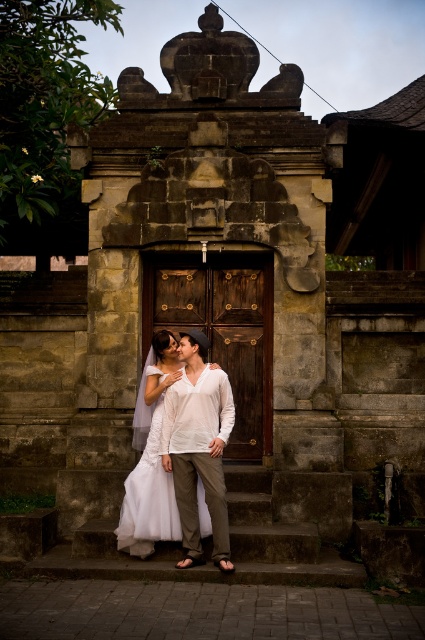
Question: Which object is closer to the camera taking this photo?

Choices:
 (A) white lace dress at center
 (B) white cotton shirt at center

Answer: (B)

Question: Which object appears closest to the camera in this image?

Choices:
 (A) white cotton shirt at center
 (B) stone stairs at center

Answer: (A)

Question: Does stone stairs at center appear on the left side of white lace dress at center?

Choices:
 (A) yes
 (B) no

Answer: (B)

Question: Does stone stairs at center appear on the right side of white cotton shirt at center?

Choices:
 (A) no
 (B) yes

Answer: (B)

Question: Among these points, which one is farthest from the camera?

Choices:
 (A) (139, 540)
 (B) (302, 531)

Answer: (B)

Question: Does stone stairs at center have a greater width compared to white lace dress at center?

Choices:
 (A) no
 (B) yes

Answer: (A)